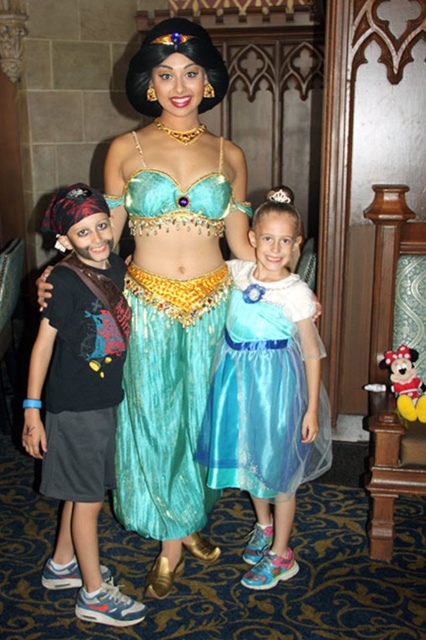
Is shiny teal dress at center below shiny teal fabric at center?

No.

What are the coordinates of `shiny teal dress at center` in the screenshot? It's located at (172, 284).

Which is below, shiny teal dress at center or shiny blue dress at center?

Positioned lower is shiny blue dress at center.

At what (x,y) coordinates should I click in order to perform the action: click on shiny teal dress at center. Please return your answer as a coordinate pair (x, y). The height and width of the screenshot is (640, 426). Looking at the image, I should click on (172, 284).

The width and height of the screenshot is (426, 640). Identify the location of shiny teal dress at center. (172, 284).

Is point (163, 508) closer to viewer compared to point (74, 198)?

No, (163, 508) is behind (74, 198).

Image resolution: width=426 pixels, height=640 pixels. In order to click on shiny teal fabric at center in this screenshot , I will do `click(170, 342)`.